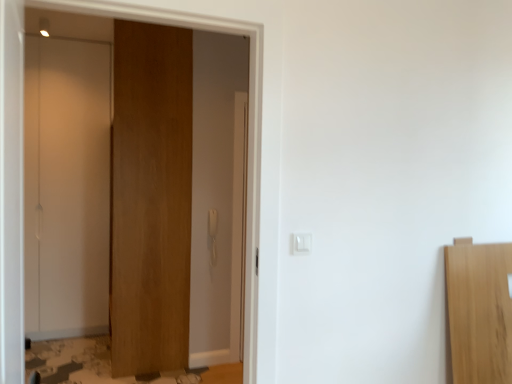
Image resolution: width=512 pixels, height=384 pixels. In order to click on wooden door at center, arranged as the first door when viewed from the right in this screenshot , I will do [150, 198].

Locate an element on the screen. light switch located in front of the white glossy door at left, which ranks as the first door in left-to-right order is located at coordinates (301, 243).

Considering the relative sizes of white glossy door at left, the second door viewed from the right, and white plastic light switch at center in the image provided, is white glossy door at left, the second door viewed from the right, bigger than white plastic light switch at center?

Correct, white glossy door at left, the second door viewed from the right, is larger in size than white plastic light switch at center.

Is white glossy door at left, which ranks as the first door in left-to-right order, outside of white plastic light switch at center?

Absolutely, white glossy door at left, which ranks as the first door in left-to-right order, is external to white plastic light switch at center.

Based on the photo, does white glossy door at left, which ranks as the first door in left-to-right order, turn towards white plastic light switch at center?

No, white glossy door at left, which ranks as the first door in left-to-right order, does not turn towards white plastic light switch at center.

Are white glossy door at left, which ranks as the first door in left-to-right order, and wooden door at center, arranged as the first door when viewed from the right, making contact?

No, white glossy door at left, which ranks as the first door in left-to-right order, is not in contact with wooden door at center, arranged as the first door when viewed from the right.

In the scene shown: Who is bigger, white glossy door at left, which ranks as the first door in left-to-right order, or wooden door at center, the second door from the left?

With larger size is wooden door at center, the second door from the left.

Is white glossy door at left, which ranks as the first door in left-to-right order, in front of or behind wooden door at center, the second door from the left, in the image?

white glossy door at left, which ranks as the first door in left-to-right order, is behind wooden door at center, the second door from the left.

How much distance is there between white glossy door at left, which ranks as the first door in left-to-right order, and wooden door at center, arranged as the first door when viewed from the right?

white glossy door at left, which ranks as the first door in left-to-right order, is 36.13 inches from wooden door at center, arranged as the first door when viewed from the right.

Are white plastic light switch at center and wooden door at center, the second door from the left, beside each other?

No, white plastic light switch at center is not beside wooden door at center, the second door from the left.

Is white plastic light switch at center surrounding wooden door at center, the second door from the left?

Definitely not — wooden door at center, the second door from the left, is not inside white plastic light switch at center.

How different are the orientations of white plastic light switch at center and wooden door at center, arranged as the first door when viewed from the right, in degrees?

The facing directions of white plastic light switch at center and wooden door at center, arranged as the first door when viewed from the right, are 0.118 degrees apart.

Looking at this image, which is closer to the camera, [309,249] or [158,92]?

Point [309,249] is closer to the camera than point [158,92].

Is white glossy door at left, which ranks as the first door in left-to-right order, surrounded by wooden door at center, arranged as the first door when viewed from the right?

No, white glossy door at left, which ranks as the first door in left-to-right order, is not inside wooden door at center, arranged as the first door when viewed from the right.

Could you tell me if wooden door at center, arranged as the first door when viewed from the right, is facing white glossy door at left, which ranks as the first door in left-to-right order?

No, wooden door at center, arranged as the first door when viewed from the right, is not turned towards white glossy door at left, which ranks as the first door in left-to-right order.

How many degrees apart are the facing directions of wooden door at center, the second door from the left, and white glossy door at left, the second door viewed from the right?

They differ by 0.333 degrees in their facing directions.

Which object is further away from the camera taking this photo, wooden door at center, the second door from the left, or white glossy door at left, which ranks as the first door in left-to-right order?

white glossy door at left, which ranks as the first door in left-to-right order, is more distant.

Is the position of white plastic light switch at center less distant than that of white glossy door at left, which ranks as the first door in left-to-right order?

Yes, white plastic light switch at center is closer to the viewer.

Measure the distance between white plastic light switch at center and white glossy door at left, which ranks as the first door in left-to-right order.

white plastic light switch at center and white glossy door at left, which ranks as the first door in left-to-right order, are 2.75 meters apart.

Which object is positioned more to the left, white plastic light switch at center or white glossy door at left, which ranks as the first door in left-to-right order?

white glossy door at left, which ranks as the first door in left-to-right order, is more to the left.

Where is `light switch located below the white glossy door at left, the second door viewed from the right (from the image's perspective)`? This screenshot has height=384, width=512. light switch located below the white glossy door at left, the second door viewed from the right (from the image's perspective) is located at coordinates (301, 243).

Based on the photo, would you consider wooden door at center, the second door from the left, to be distant from white plastic light switch at center?

Absolutely, wooden door at center, the second door from the left, is distant from white plastic light switch at center.

Locate an element on the screen. This screenshot has height=384, width=512. door that is the 2nd one above the white plastic light switch at center (from a real-world perspective) is located at coordinates (150, 198).

From the picture: Between wooden door at center, the second door from the left, and white plastic light switch at center, which one has larger width?

Wider between the two is wooden door at center, the second door from the left.

Locate an element on the screen. Image resolution: width=512 pixels, height=384 pixels. the 2nd door behind the white plastic light switch at center is located at coordinates (66, 187).

Locate an element on the screen. door lying below the white glossy door at left, the second door viewed from the right (from the image's perspective) is located at coordinates (150, 198).

Based on their spatial positions, is wooden door at center, the second door from the left, or white plastic light switch at center further from white glossy door at left, which ranks as the first door in left-to-right order?

Among the two, white plastic light switch at center is located further to white glossy door at left, which ranks as the first door in left-to-right order.

Considering their positions, is white glossy door at left, the second door viewed from the right, positioned further to white plastic light switch at center than wooden door at center, arranged as the first door when viewed from the right?

white glossy door at left, the second door viewed from the right, lies further to white plastic light switch at center than the other object.

When comparing their distances from wooden door at center, arranged as the first door when viewed from the right, does white plastic light switch at center or white glossy door at left, which ranks as the first door in left-to-right order, seem closer?

The object closer to wooden door at center, arranged as the first door when viewed from the right, is white glossy door at left, which ranks as the first door in left-to-right order.

Considering their positions, is wooden door at center, the second door from the left, positioned closer to white plastic light switch at center than white glossy door at left, the second door viewed from the right?

Among the two, wooden door at center, the second door from the left, is located nearer to white plastic light switch at center.

Which object lies nearer to the anchor point wooden door at center, arranged as the first door when viewed from the right, white glossy door at left, the second door viewed from the right, or white plastic light switch at center?

Among the two, white glossy door at left, the second door viewed from the right, is located nearer to wooden door at center, arranged as the first door when viewed from the right.

Estimate the real-world distances between objects in this image. Which object is closer to white glossy door at left, the second door viewed from the right, white plastic light switch at center or wooden door at center, the second door from the left?

Among the two, wooden door at center, the second door from the left, is located nearer to white glossy door at left, the second door viewed from the right.

At what (x,y) coordinates should I click in order to perform the action: click on door located between white plastic light switch at center and white glossy door at left, which ranks as the first door in left-to-right order, in the depth direction. Please return your answer as a coordinate pair (x, y). The height and width of the screenshot is (384, 512). Looking at the image, I should click on (150, 198).